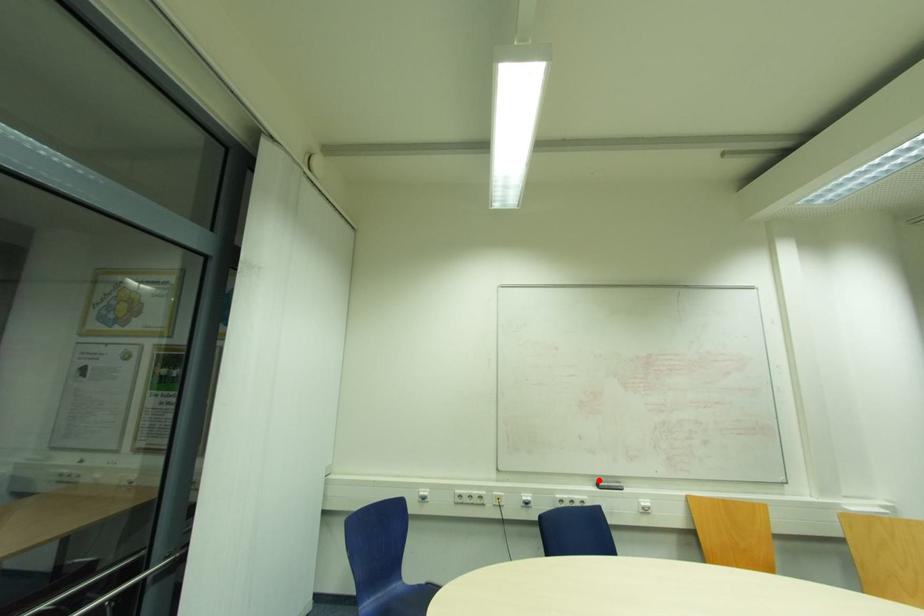
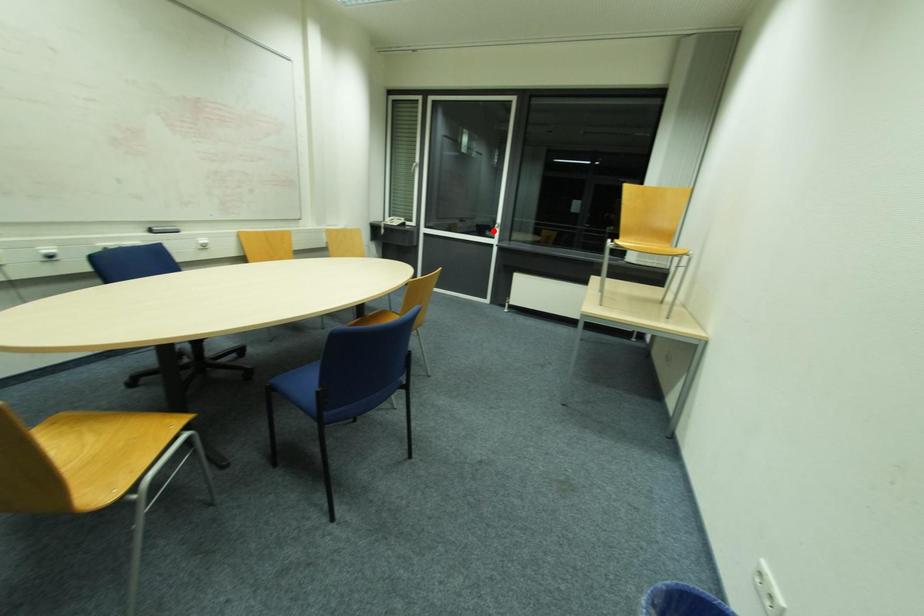
I am providing you with two images of the same scene from different viewpoints. A red point is marked on the first image and another point is marked on the second image. Does the point marked in image1 correspond to the same location as the one in image2?

No